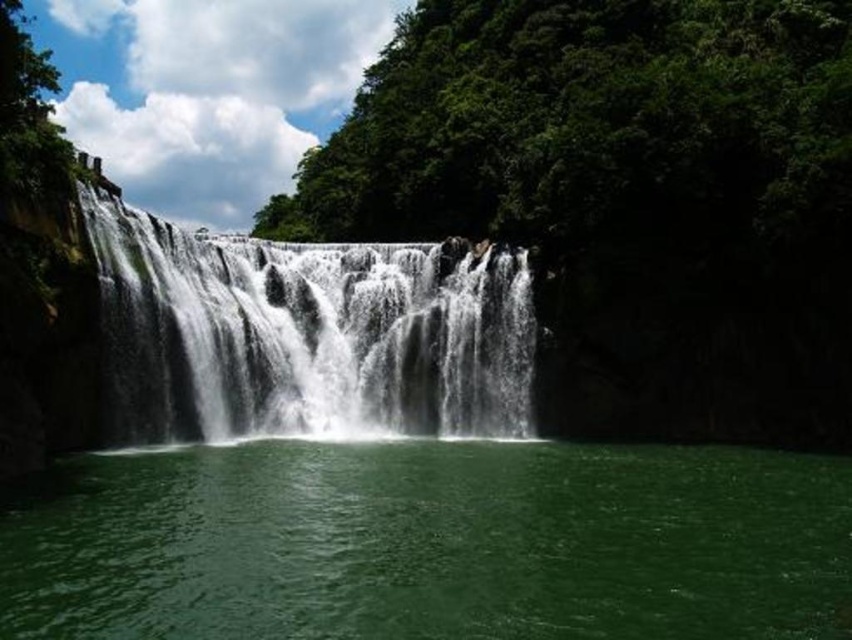
Question: Is green liquid at center smaller than white frothy water at center?

Choices:
 (A) yes
 (B) no

Answer: (A)

Question: Which object is farther from the camera taking this photo?

Choices:
 (A) white frothy water at center
 (B) green liquid at center

Answer: (A)

Question: Does green liquid at center have a greater width compared to white frothy water at center?

Choices:
 (A) no
 (B) yes

Answer: (B)

Question: Where is green liquid at center located in relation to white frothy water at center in the image?

Choices:
 (A) right
 (B) left

Answer: (A)